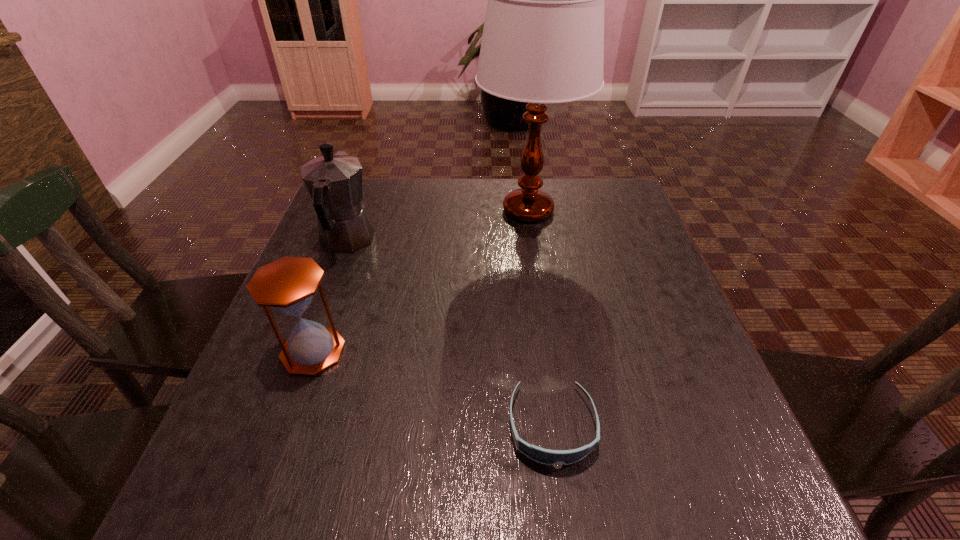
Locate an element on the screen. The height and width of the screenshot is (540, 960). table lamp is located at coordinates (543, 39).

At what (x,y) coordinates should I click in order to perform the action: click on coffeepot. Please return your answer as a coordinate pair (x, y). This screenshot has height=540, width=960. Looking at the image, I should click on (334, 181).

Where is `hourglass`? This screenshot has width=960, height=540. hourglass is located at coordinates (288, 284).

Identify the location of the second shortest object. (288, 284).

The height and width of the screenshot is (540, 960). Identify the location of the shortest object. (544, 456).

Image resolution: width=960 pixels, height=540 pixels. I want to click on goggles, so click(544, 456).

Identify the location of free space located 0.300m on the front of the table lamp. This screenshot has height=540, width=960. (546, 335).

The width and height of the screenshot is (960, 540). In order to click on vacant position located on the pouring side of the second tallest object in this screenshot , I will do `click(362, 200)`.

Where is `vacant space located 0.150m on the pouring side of the second tallest object`? The width and height of the screenshot is (960, 540). vacant space located 0.150m on the pouring side of the second tallest object is located at coordinates (367, 187).

At what (x,y) coordinates should I click in order to perform the action: click on free point located on the pouring side of the second tallest object. Please return your answer as a coordinate pair (x, y). Looking at the image, I should click on (364, 194).